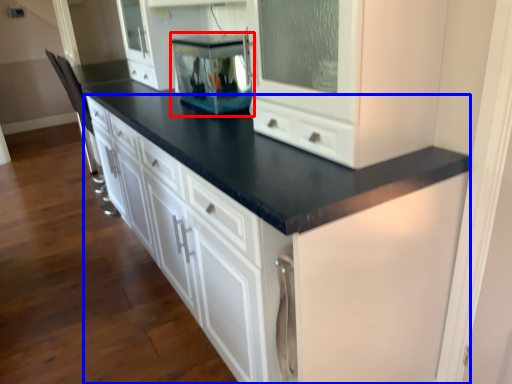
Question: Which object appears farthest to the camera in this image, appliance (highlighted by a red box) or cabinetry (highlighted by a blue box)?

Choices:
 (A) appliance
 (B) cabinetry

Answer: (A)